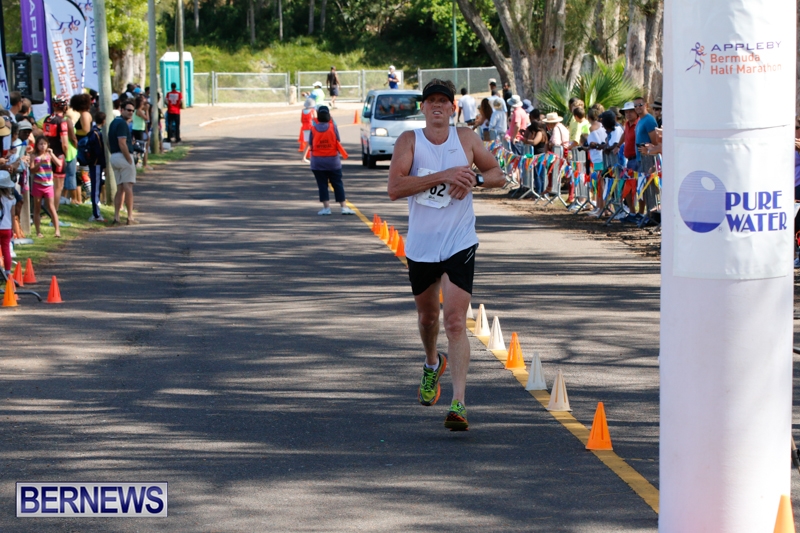
Identify the location of pennant banner. Image resolution: width=800 pixels, height=533 pixels. (626, 191), (532, 164), (510, 160).